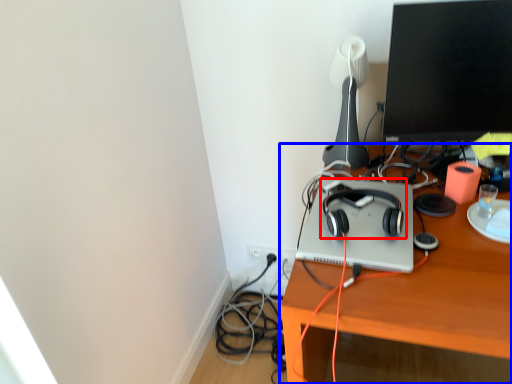
Question: Which point is further to the camera, headphones (highlighted by a red box) or desk (highlighted by a blue box)?

Choices:
 (A) headphones
 (B) desk

Answer: (A)